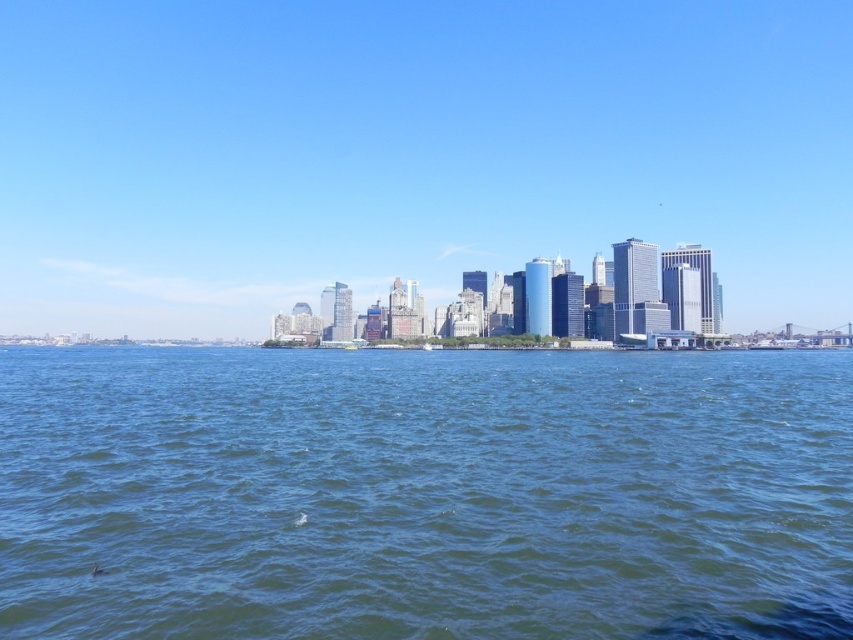
Question: Which point is farther to the camera?

Choices:
 (A) blue glass skyscrapers at center
 (B) blue liquid water at center

Answer: (A)

Question: Where is blue glass skyscrapers at center located in relation to blue liquid water at center in the image?

Choices:
 (A) left
 (B) right

Answer: (A)

Question: Which point is closer to the camera?

Choices:
 (A) (457, 518)
 (B) (682, 60)

Answer: (A)

Question: Does blue glass skyscrapers at center have a lesser width compared to blue liquid water at center?

Choices:
 (A) no
 (B) yes

Answer: (A)

Question: Is blue glass skyscrapers at center to the right of blue liquid water at center from the viewer's perspective?

Choices:
 (A) no
 (B) yes

Answer: (A)